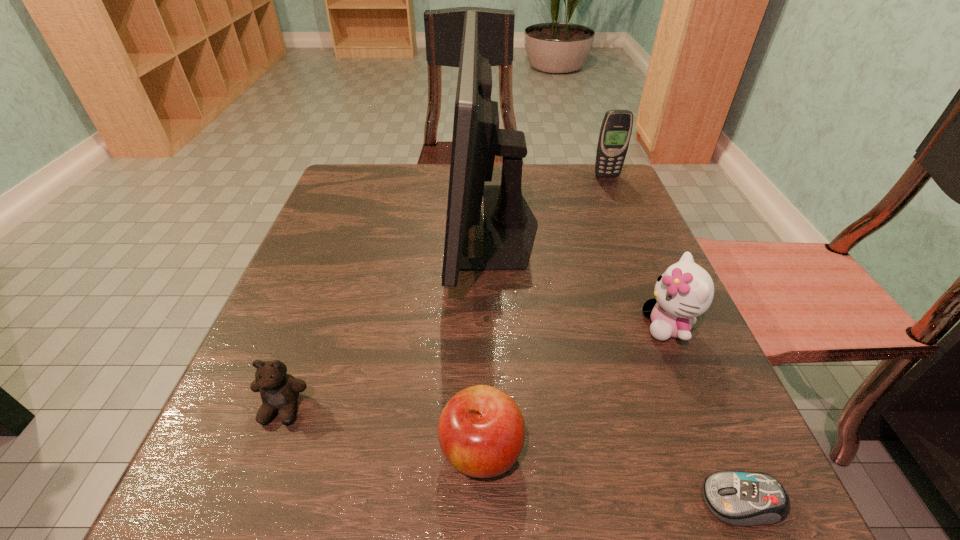
Identify the location of the tallest object. (510, 226).

Locate an element on the screen. This screenshot has width=960, height=540. the second tallest object is located at coordinates click(616, 128).

Find the location of a particular element. kitten is located at coordinates (685, 290).

Find the location of a particular element. This screenshot has width=960, height=540. apple is located at coordinates (481, 432).

The height and width of the screenshot is (540, 960). I want to click on teddy bear, so click(279, 391).

Find the location of `computer mouse`. computer mouse is located at coordinates (741, 498).

In order to click on vacant space located 0.050m on the screen side of the tallest object in this screenshot , I will do `click(428, 224)`.

Locate an element on the screen. The image size is (960, 540). vacant space situated 0.210m on the screen side of the tallest object is located at coordinates (356, 224).

Locate an element on the screen. This screenshot has width=960, height=540. free space located on the screen side of the tallest object is located at coordinates (401, 224).

At what (x,y) coordinates should I click in order to perform the action: click on blank space located 0.170m on the screen of the cellular telephone. Please return your answer as a coordinate pair (x, y). The width and height of the screenshot is (960, 540). Looking at the image, I should click on (623, 215).